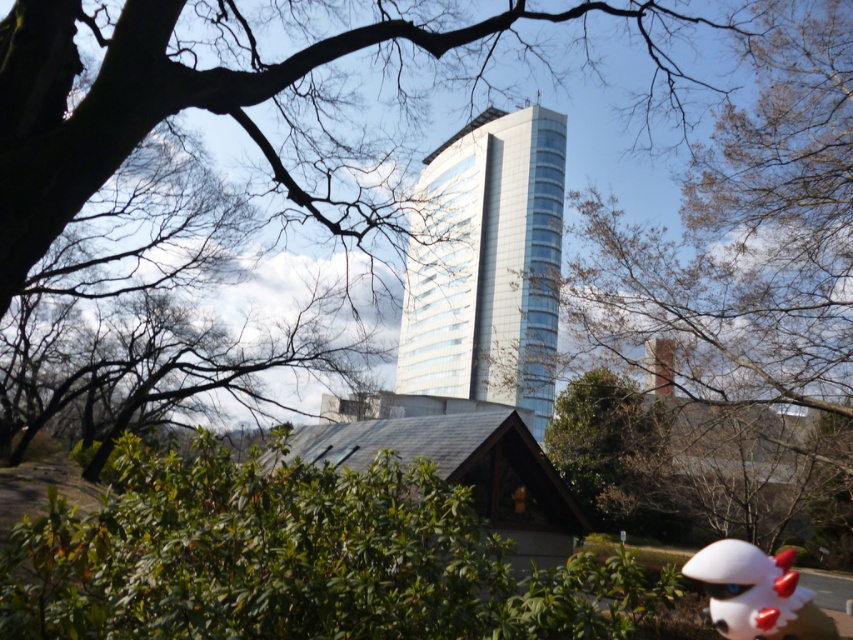
Question: Where is bare branches at upper center located in relation to transparent glass tower at center in the image?

Choices:
 (A) below
 (B) above

Answer: (A)

Question: Which point is closer to the camera?

Choices:
 (A) (718, 429)
 (B) (537, 237)
 (C) (378, 225)
 (D) (737, 609)

Answer: (D)

Question: Which point is farther to the camera?

Choices:
 (A) white matte plush toy at lower right
 (B) bare branches at upper center

Answer: (B)

Question: Which object is farther from the camera taking this photo?

Choices:
 (A) white matte plush toy at lower right
 (B) green leafy tree at center
 (C) bare branches at upper center
 (D) transparent glass tower at center

Answer: (D)

Question: Considering the relative positions of green leafy tree at center and bare branches at upper center in the image provided, where is green leafy tree at center located with respect to bare branches at upper center?

Choices:
 (A) left
 (B) right

Answer: (A)

Question: Can you confirm if green leafy tree at center is positioned below transparent glass tower at center?

Choices:
 (A) no
 (B) yes

Answer: (A)